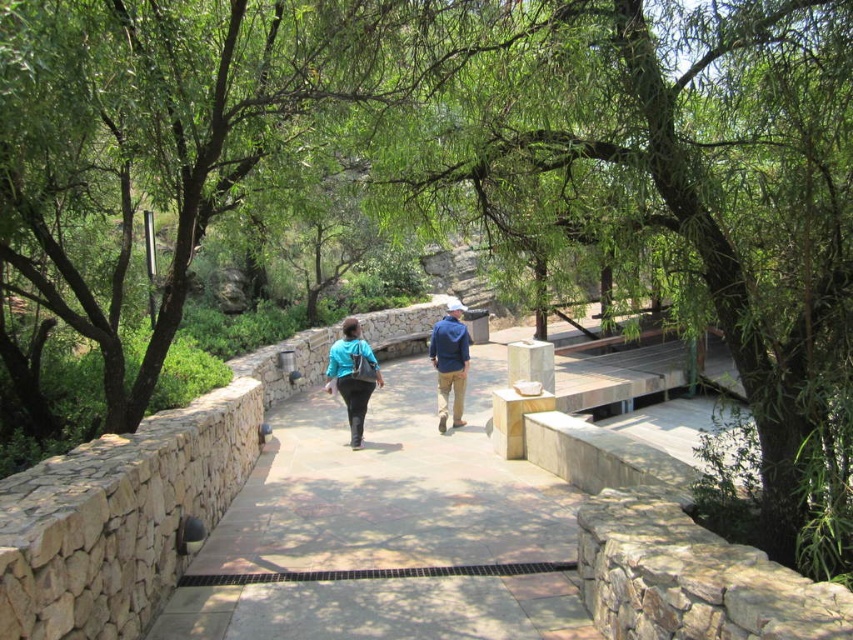
You are standing on the pathway and see both the blue fabric jacket at center and the blue denim jacket at center. Which jacket is positioned closer to your left side?

The blue fabric jacket at center is positioned to the left of the blue denim jacket at center, so it is closer to your left side.

You are standing on the pathway and see two jackets at the center of the scene. Which jacket is positioned lower between the blue fabric jacket at center and the blue denim jacket at center?

The blue fabric jacket at center is located below the blue denim jacket at center, so it is positioned lower.

You are standing on the brown stone path at center and see a matte blue jacket at center. Which direction should you walk to reach the jacket?

The matte blue jacket at center is to the left of the brown stone path at center, so you should walk to the left to reach it.